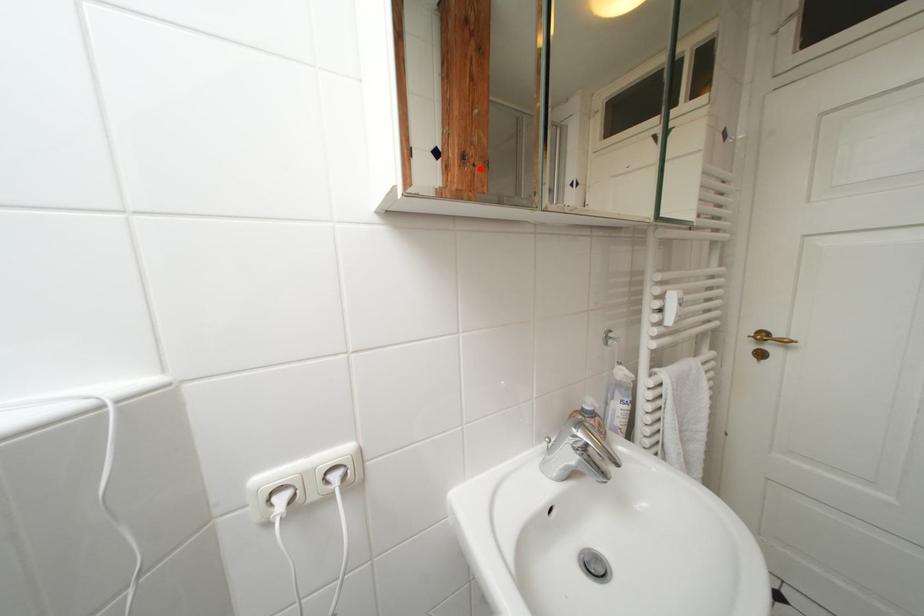
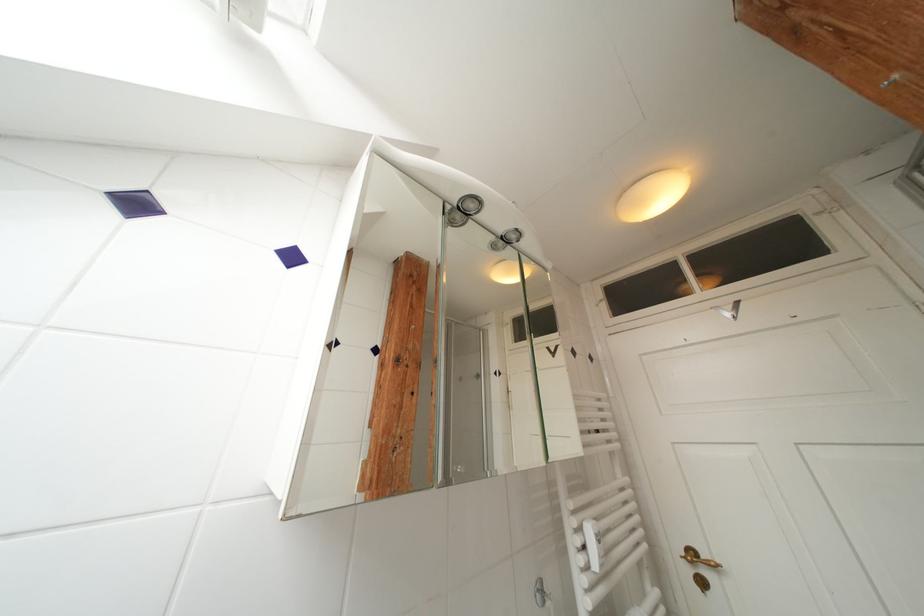
In the second image, find the point that corresponds to the highlighted location in the first image.

(412, 370)